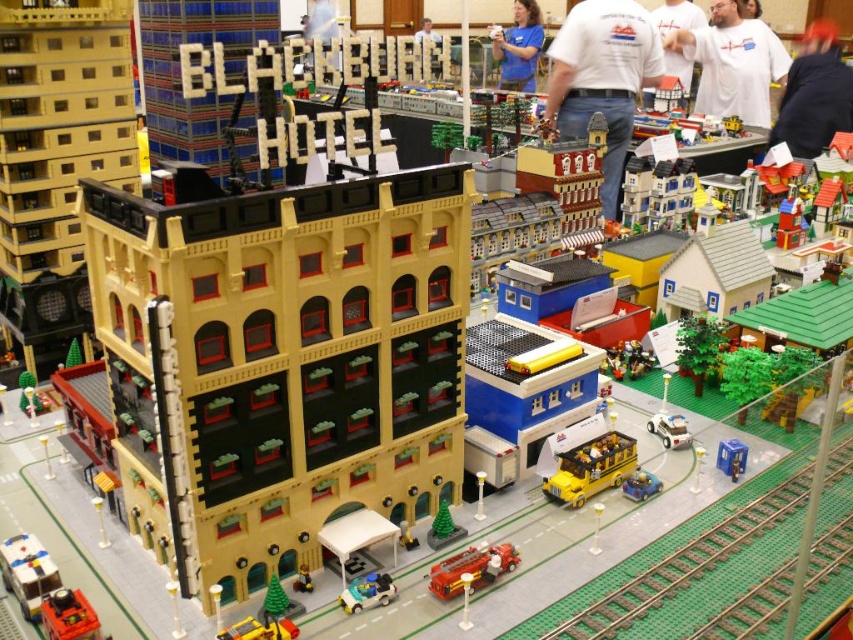
Question: Which of the following is the closest to the observer?

Choices:
 (A) (77, 612)
 (B) (647, 472)
 (C) (814, 156)

Answer: (A)

Question: Which point appears farthest from the camera in this image?

Choices:
 (A) (732, 74)
 (B) (643, 480)
 (C) (476, 557)

Answer: (A)

Question: Is shiny red fire truck at center wider than white t-shirt at upper center?

Choices:
 (A) yes
 (B) no

Answer: (A)

Question: Is yellow matte school bus at center thinner than shiny black train at lower left?

Choices:
 (A) yes
 (B) no

Answer: (B)

Question: Is blue shirt at upper center positioned before shiny red fire truck at center?

Choices:
 (A) yes
 (B) no

Answer: (B)

Question: Which object is farther from the camera taking this photo?

Choices:
 (A) dark blue jacket at upper right
 (B) shiny red fire truck at center
 (C) green textured train track at lower right

Answer: (A)